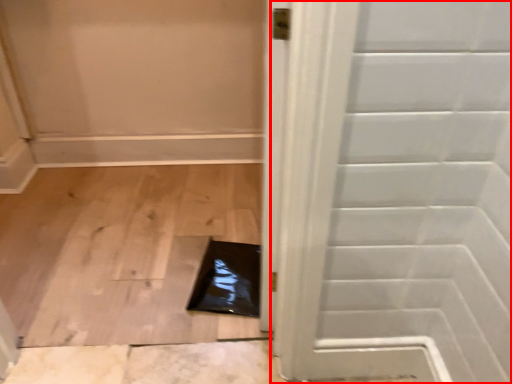
Question: Observing the image, what is the correct spatial positioning of door (annotated by the red box) in reference to hole?

Choices:
 (A) left
 (B) right

Answer: (B)